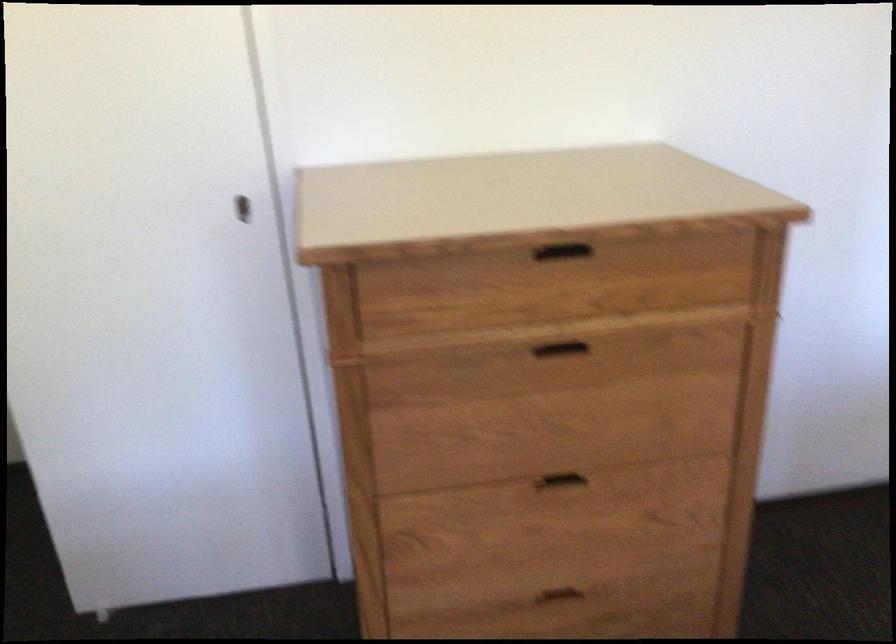
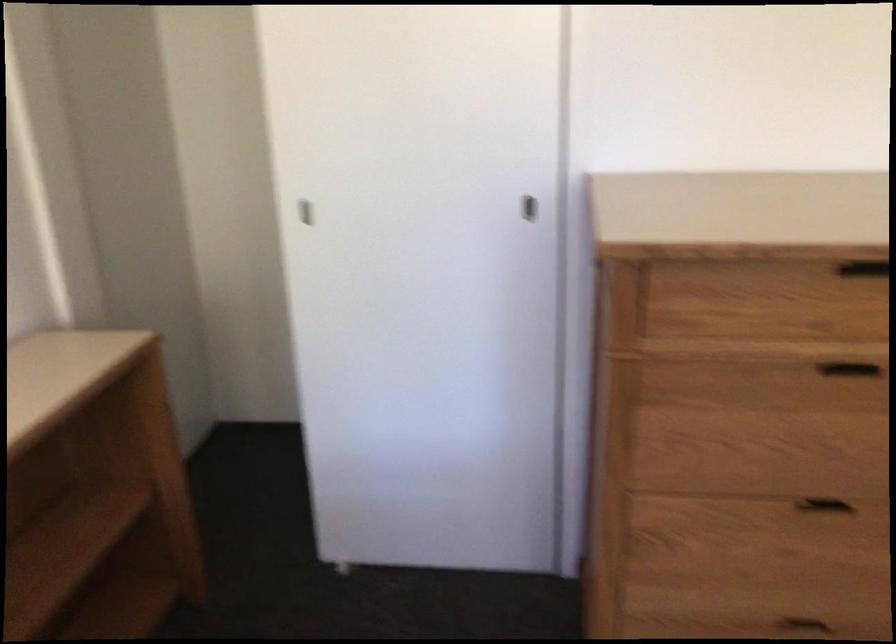
In a continuous first-person perspective shot, in which direction is the camera moving?

The cameraman moved toward left, backward.